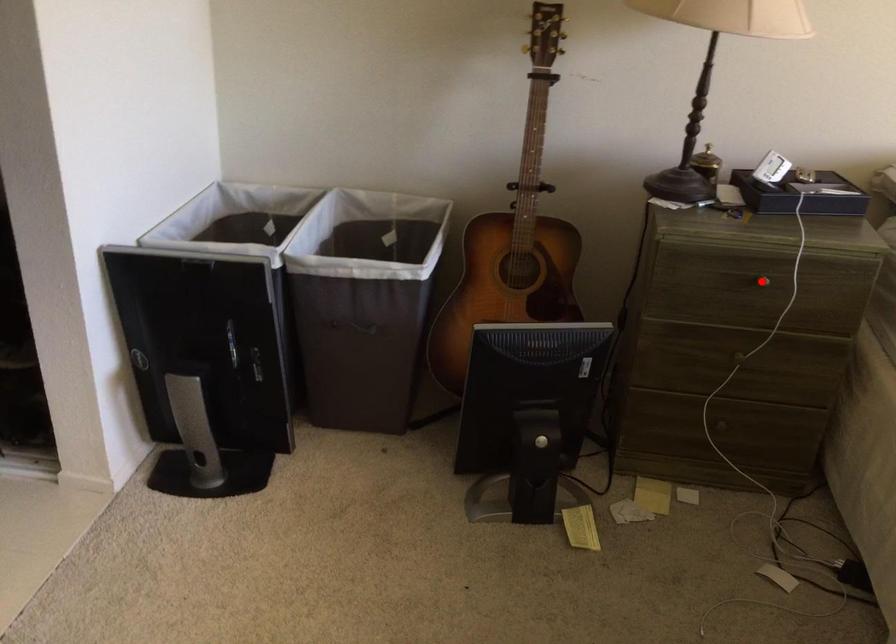
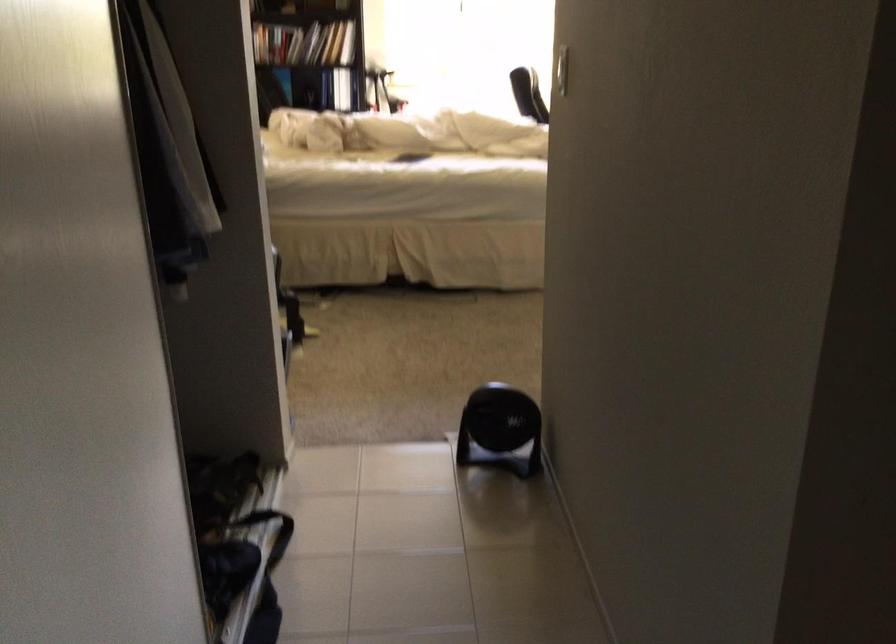
Question: I am providing you with two images of the same scene from different viewpoints. A red point is marked on the first image. Can you still see the location of the red point in image 2?

Choices:
 (A) Yes
 (B) No

Answer: (B)